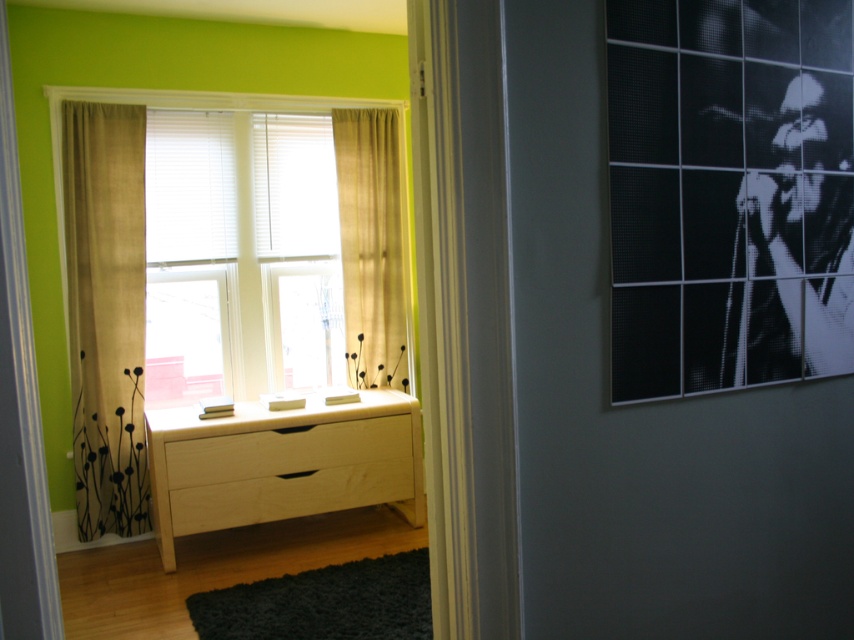
Is matte wood window at center smaller than white matte drawer at center?

Incorrect, matte wood window at center is not smaller in size than white matte drawer at center.

Who is more forward, (154,104) or (376,433)?

Point (376,433)

Locate an element on the screen. The height and width of the screenshot is (640, 854). matte wood window at center is located at coordinates (234, 116).

What do you see at coordinates (729, 193) in the screenshot? I see `black mesh poster at upper right` at bounding box center [729, 193].

Is point (746, 337) positioned in front of point (396, 128)?

Yes, it is in front of point (396, 128).

Is point (791, 22) in front of point (390, 177)?

That is True.

Where is `black mesh poster at upper right`? This screenshot has height=640, width=854. black mesh poster at upper right is located at coordinates (729, 193).

Does burlap curtain at left appear under beige fabric curtain at center?

Correct, burlap curtain at left is located below beige fabric curtain at center.

Does point (110, 225) come behind point (402, 358)?

No.

Measure the distance between burlap curtain at left and camera.

burlap curtain at left is 11.45 feet from camera.

Locate an element on the screen. The image size is (854, 640). burlap curtain at left is located at coordinates (106, 312).